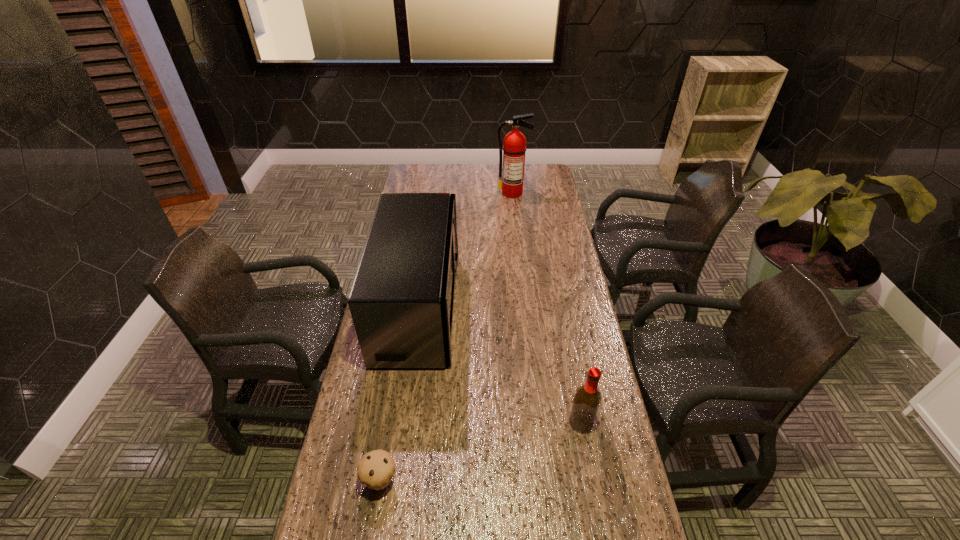
Image resolution: width=960 pixels, height=540 pixels. I want to click on free space located on the back of the second nearest object, so click(x=570, y=363).

Locate an element on the screen. free space located on the back of the shortest object is located at coordinates (391, 416).

Locate an element on the screen. microwave_oven located in the left edge section of the desktop is located at coordinates (402, 299).

You are a GUI agent. You are given a task and a screenshot of the screen. Output one action in this format:
    pyautogui.click(x=<x>, y=<y>)
    Task: Click on the muffin that is at the left edge
    The width and height of the screenshot is (960, 540).
    Given the screenshot: What is the action you would take?
    pyautogui.click(x=376, y=469)

The width and height of the screenshot is (960, 540). I want to click on fire extinguisher located in the right edge section of the desktop, so click(511, 182).

The image size is (960, 540). In order to click on beer bottle that is at the right edge in this screenshot , I will do `click(587, 399)`.

This screenshot has width=960, height=540. In the image, there is a desktop. What are the coordinates of `vacant area at the left edge` in the screenshot? It's located at (357, 414).

Locate an element on the screen. vacant space at the right edge of the desktop is located at coordinates (556, 209).

This screenshot has height=540, width=960. What are the coordinates of `vacant point located between the third nearest object and the second shortest object` in the screenshot? It's located at (500, 364).

Image resolution: width=960 pixels, height=540 pixels. Find the location of `free space between the nearest object and the third nearest object`. free space between the nearest object and the third nearest object is located at coordinates (399, 393).